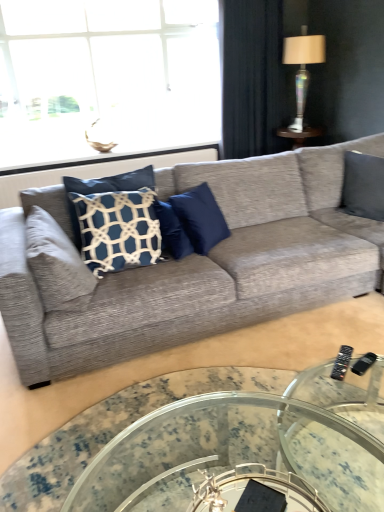
Question: Considering the positions of blue velvet pillow at center, positioned as the first pillow in right-to-left order, and translucent glass lampshade at upper right in the image, is blue velvet pillow at center, positioned as the first pillow in right-to-left order, wider or thinner than translucent glass lampshade at upper right?

Choices:
 (A) thin
 (B) wide

Answer: (A)

Question: In terms of size, does blue velvet pillow at center, which is the 2th pillow from left to right, appear bigger or smaller than translucent glass lampshade at upper right?

Choices:
 (A) big
 (B) small

Answer: (B)

Question: Which object is the closest to the translucent glass lampshade at upper right?

Choices:
 (A) dark blue fabric curtain at upper right
 (B) white textured pillow at left, which appears as the 2th pillow when viewed from the right
 (C) transparent glass coffee table at lower center
 (D) blue velvet pillow at center, positioned as the first pillow in right-to-left order
 (E) black plastic remote at lower right

Answer: (A)

Question: Based on their relative distances, which object is farther from the translucent glass lampshade at upper right?

Choices:
 (A) clear glass window at upper left
 (B) textured gray couch at center
 (C) black plastic remote at lower right
 (D) white textured pillow at left, placed as the 1th pillow when sorted from left to right
 (E) dark blue fabric curtain at upper right

Answer: (D)